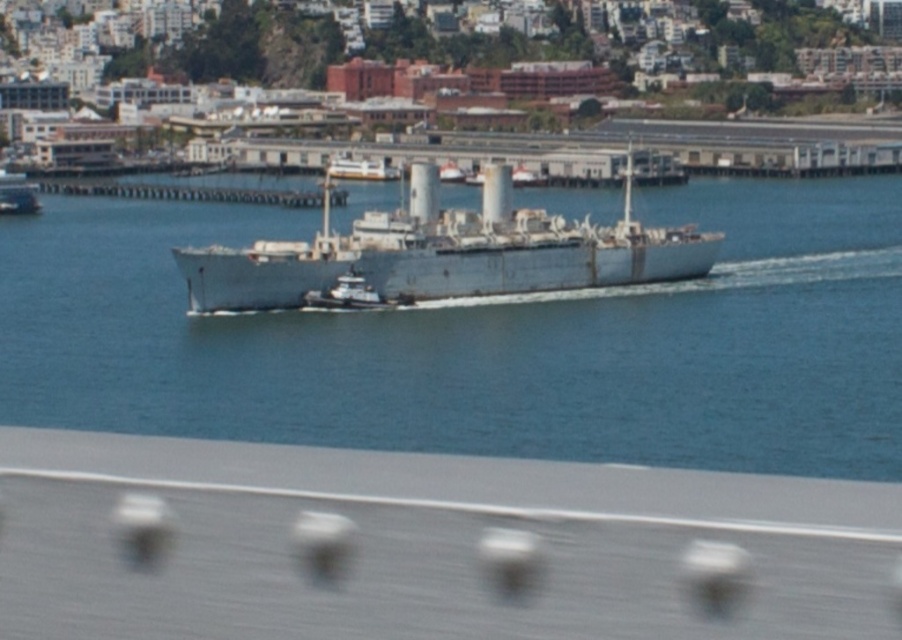
You are on a boat and looking at the image. You see the blue water at center and the gray metallic ship at center. Which one is located below the other?

The blue water at center is positioned under the gray metallic ship at center, so the blue water at center is below the gray metallic ship at center.

You are a photographer trying to capture the entire scene of the gray metallic ship at center and the blue water at center in one shot. Based on their sizes, which one will occupy more of the frame?

The blue water at center is larger in size than the gray metallic ship at center, so it will occupy more of the frame.